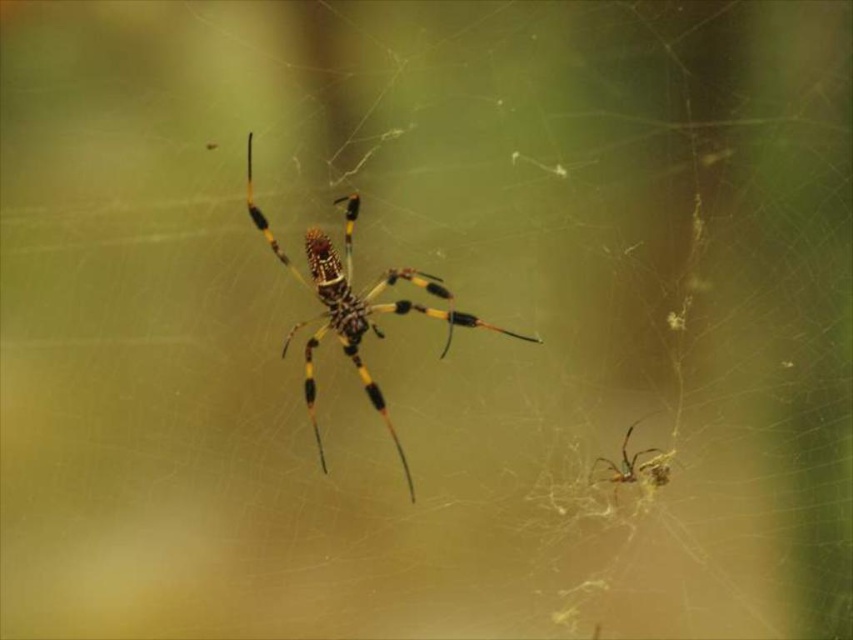
Question: Can you confirm if yellow and black fuzzy spider at center is thinner than shiny metallic spider at lower right?

Choices:
 (A) no
 (B) yes

Answer: (A)

Question: Which object appears farthest from the camera in this image?

Choices:
 (A) yellow and black fuzzy spider at center
 (B) shiny metallic spider at lower right

Answer: (B)

Question: Is yellow and black fuzzy spider at center above shiny metallic spider at lower right?

Choices:
 (A) no
 (B) yes

Answer: (B)

Question: Considering the relative positions of yellow and black fuzzy spider at center and shiny metallic spider at lower right in the image provided, where is yellow and black fuzzy spider at center located with respect to shiny metallic spider at lower right?

Choices:
 (A) above
 (B) below

Answer: (A)

Question: Which of the following is the farthest from the observer?

Choices:
 (A) (621, 456)
 (B) (393, 269)

Answer: (B)